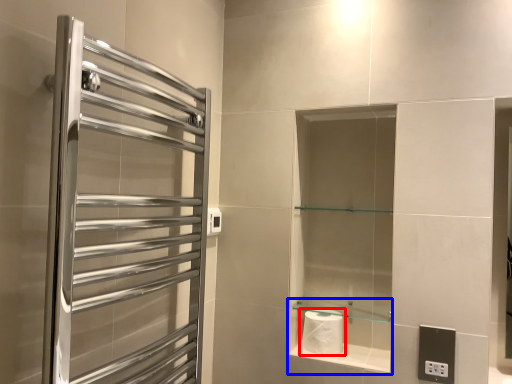
Question: Which of the following is the farthest to the observer, toilet paper (highlighted by a red box) or cabinet (highlighted by a blue box)?

Choices:
 (A) toilet paper
 (B) cabinet

Answer: (A)